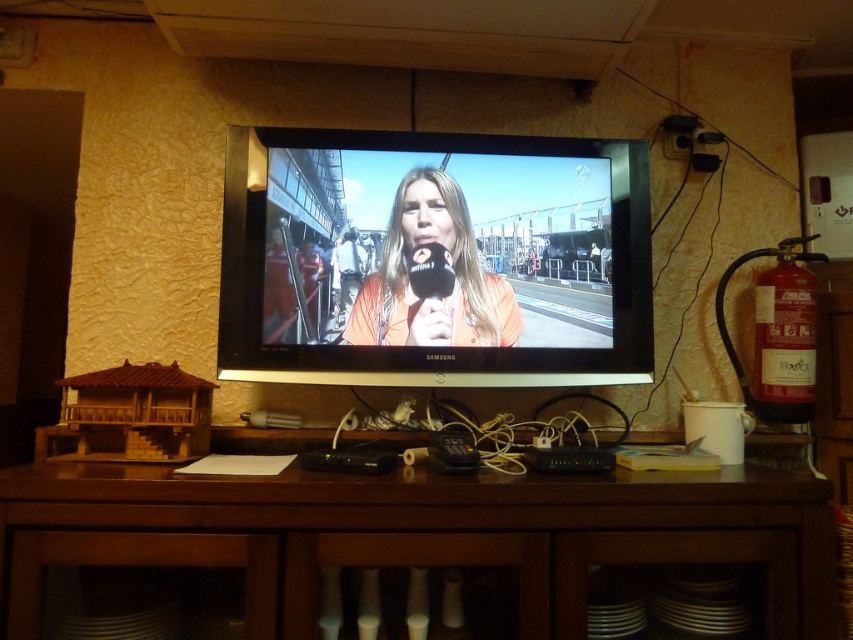
Which is below, orange matte/matteobject at center or orange fabric microphone at center?

orange fabric microphone at center

Is point (401, 208) behind point (517, 330)?

Yes, it is.

The image size is (853, 640). What are the coordinates of `orange matte/matteobject at center` in the screenshot? It's located at (450, 243).

Identify the location of brown wood entertainment center at lower center. The image size is (853, 640). (434, 532).

Is point (555, 573) farther from viewer compared to point (409, 237)?

No.

Which is in front, point (583, 580) or point (373, 307)?

Positioned in front is point (583, 580).

Locate an element on the screen. The width and height of the screenshot is (853, 640). brown wood entertainment center at lower center is located at coordinates (434, 532).

Locate an element on the screen. This screenshot has height=640, width=853. brown wood entertainment center at lower center is located at coordinates (434, 532).

Does brown wood entertainment center at lower center have a smaller size compared to orange matte/matteobject at center?

No, brown wood entertainment center at lower center is not smaller than orange matte/matteobject at center.

The image size is (853, 640). Find the location of `brown wood entertainment center at lower center`. brown wood entertainment center at lower center is located at coordinates (434, 532).